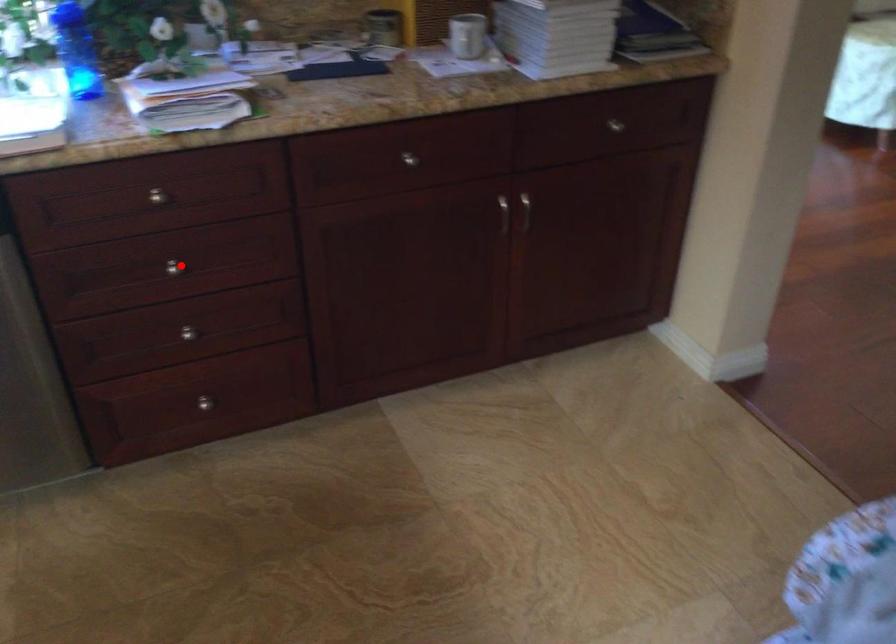
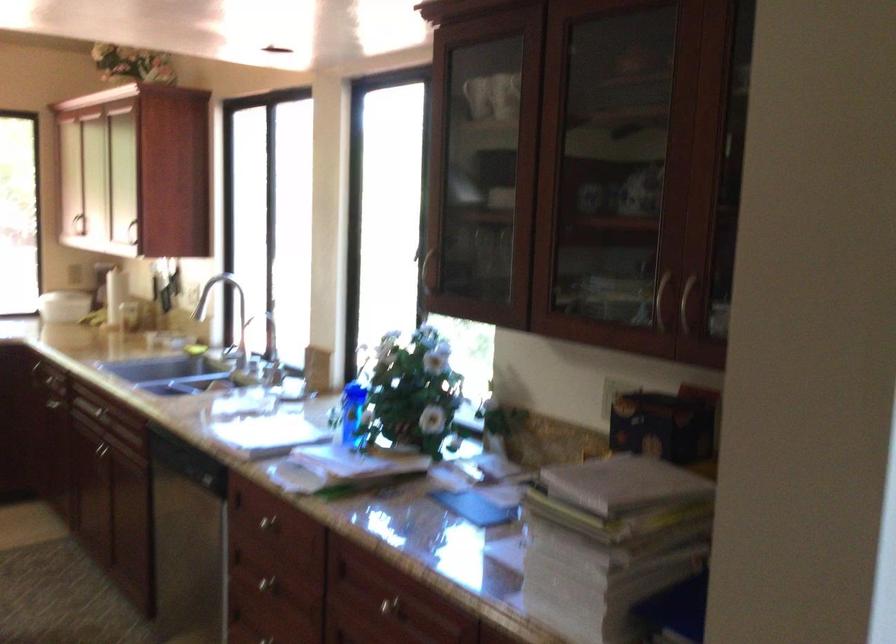
Locate, in the second image, the point that corresponds to the highlighted location in the first image.

(266, 583)